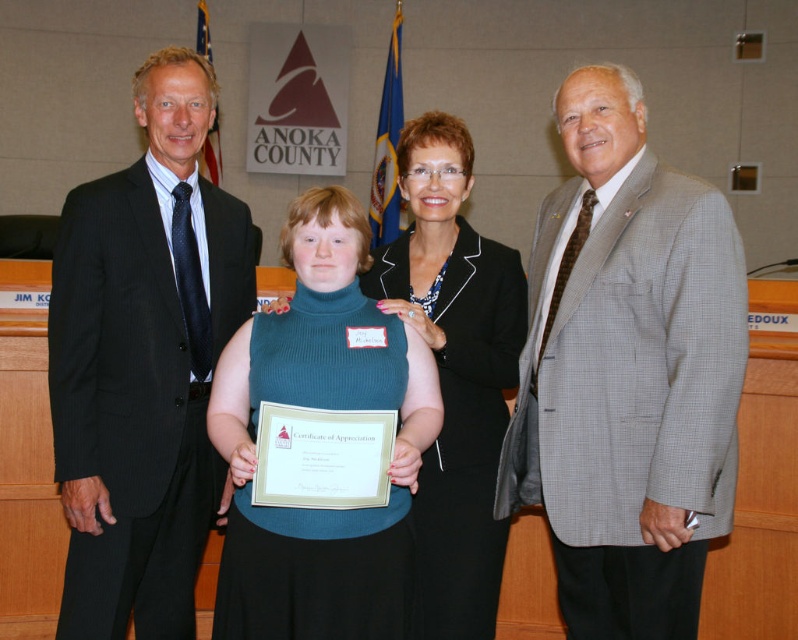
You are a photographer who needs to adjust the lighting between the teal turtleneck sweater at center and the black wool suit at center. Since they are both at the center, how far apart are they to ensure proper lighting coverage?

The teal turtleneck sweater at center and the black wool suit at center are 30.37 centimeters apart, so the photographer should adjust the lighting to cover this distance between them.

From the picture: In the formal group photo, there are two individuals dressed in a gray checkered suit at right and a black wool suit at center. Which of these two individuals is positioned more to the right side of the image?

The gray checkered suit at right is positioned more to the right than the black wool suit at center.

You are standing in the courtroom and see two points marked in the image. Which point is closer to you, point (282, 524) or point (488, 524)?

Point (282, 524) is closer to the camera than point (488, 524).